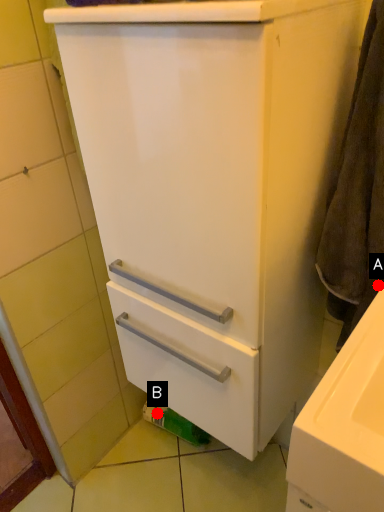
Question: Two points are circled on the image, labeled by A and B beside each circle. Which point is closer to the camera taking this photo?

Choices:
 (A) A is closer
 (B) B is closer

Answer: (A)